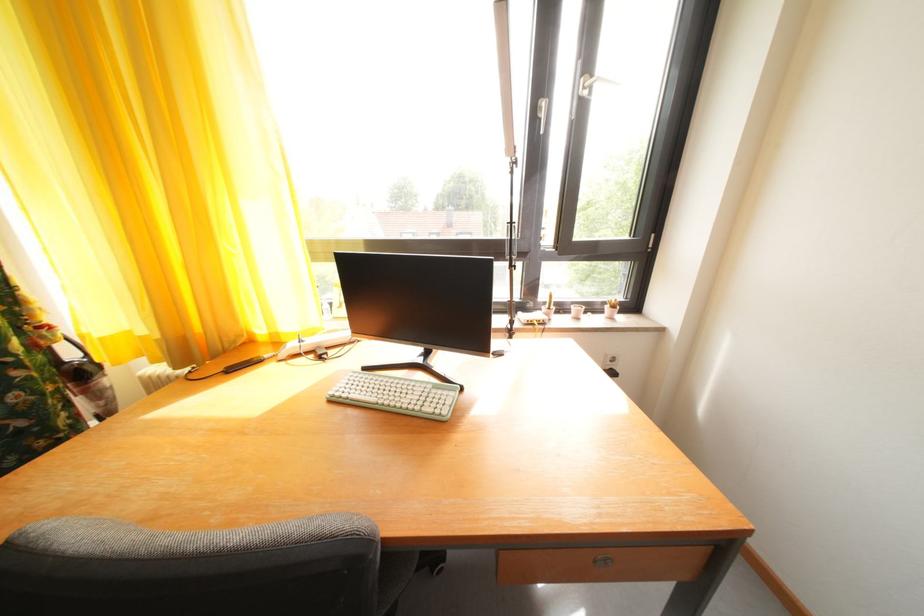
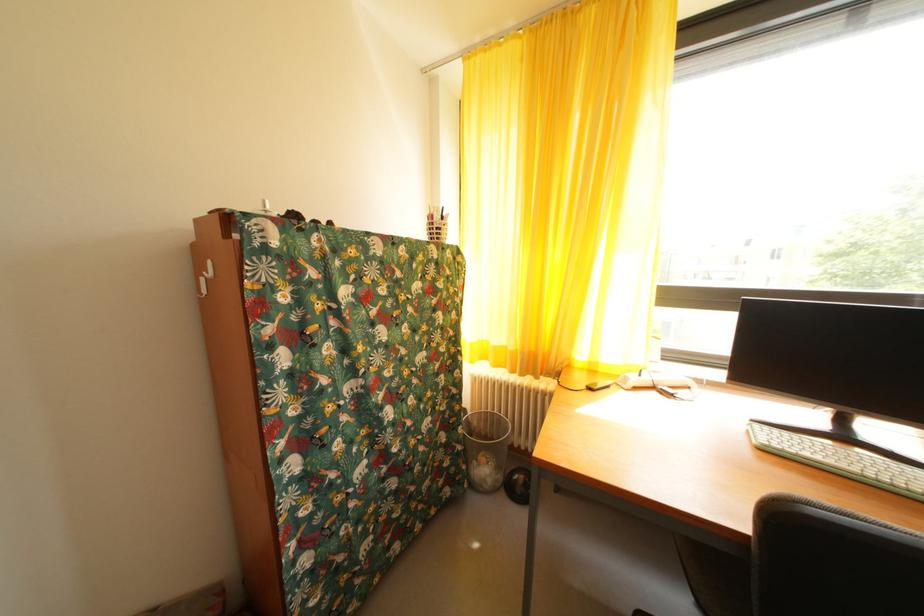
In the second image, find the point that corresponds to (x=152, y=345) in the first image.

(505, 354)